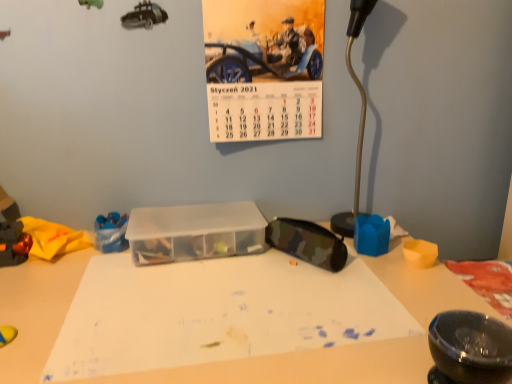
Question: From the image's perspective, is shiny metallic toy car at left, the third toy from the right, above or below transparent plastic container at center?

Choices:
 (A) below
 (B) above

Answer: (A)

Question: Is shiny metallic toy car at left, the third toy from the right, inside or outside of transparent plastic container at center?

Choices:
 (A) outside
 (B) inside

Answer: (A)

Question: Which of these objects is positioned closest to the shiny metallic toy car at left, the first toy in the left-to-right sequence?

Choices:
 (A) camo fabric pouch at center-right
 (B) transparent plastic container at center
 (C) blue plastic toy at lower left, acting as the 2th toy starting from the left
 (D) blue foam toy at center-right, the 3th toy viewed from the left
 (E) glossy black bowl at lower right

Answer: (C)

Question: Considering the real-world distances, which object is closest to the camo fabric pouch at center-right?

Choices:
 (A) glossy black bowl at lower right
 (B) blue plastic toy at lower left, which ranks as the 2th toy in right-to-left order
 (C) blue foam toy at center-right, marked as the first toy in a right-to-left arrangement
 (D) shiny metallic toy car at left, the first toy in the left-to-right sequence
 (E) metallic silver lamp at right

Answer: (C)